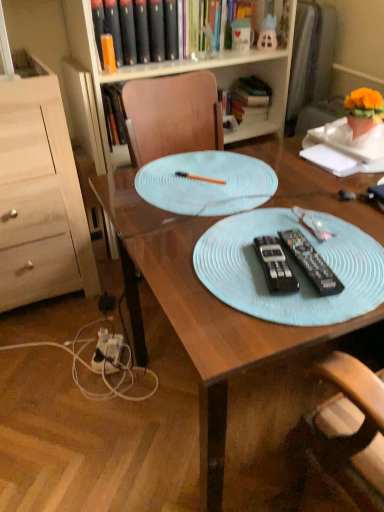
Locate an element on the screen. The width and height of the screenshot is (384, 512). empty space that is to the right of white plastic power outlet at lower left is located at coordinates (158, 367).